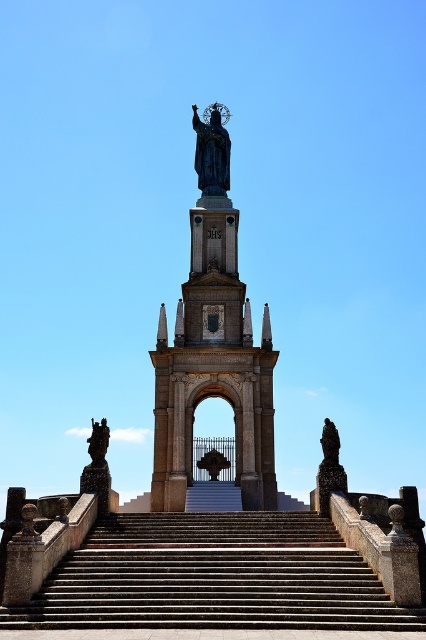
Which of these two, polished bronze statue at center or bronze statue at right, stands taller?

bronze statue at right

Does polished bronze statue at center have a larger size compared to bronze statue at right?

Incorrect, polished bronze statue at center is not larger than bronze statue at right.

Is point (204, 141) less distant than point (333, 467)?

No, (204, 141) is further to viewer.

Image resolution: width=426 pixels, height=640 pixels. In order to click on polished bronze statue at center in this screenshot , I will do `click(212, 150)`.

Measure the distance from bronze statue at center to bronze statue at left.

23.23 meters

At what (x,y) coordinates should I click in order to perform the action: click on bronze statue at center. Please return your answer as a coordinate pair (x, y). This screenshot has height=640, width=426. Looking at the image, I should click on (213, 346).

You are a GUI agent. You are given a task and a screenshot of the screen. Output one action in this format:
    pyautogui.click(x=<x>, y=<y>)
    Task: Click on the bronze statue at center
    Image resolution: width=426 pixels, height=640 pixels.
    Given the screenshot: What is the action you would take?
    pyautogui.click(x=213, y=346)

Is bronze statue at center above polished bronze statue at center?

Incorrect, bronze statue at center is not positioned above polished bronze statue at center.

Identify the location of bronze statue at center. (213, 346).

Where is `bronze statue at center`? bronze statue at center is located at coordinates (213, 346).